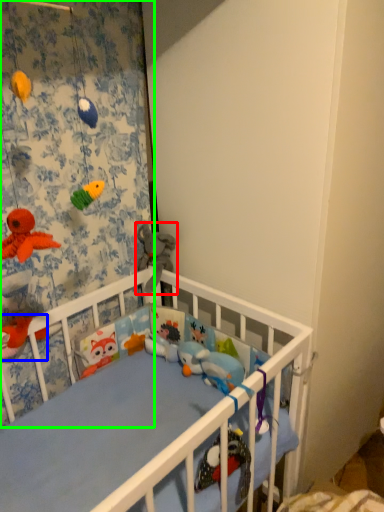
Question: Which object is the farthest from toy (highlighted by a red box)? Choose among these: toy (highlighted by a blue box) or curtain (highlighted by a green box).

Choices:
 (A) toy
 (B) curtain

Answer: (A)